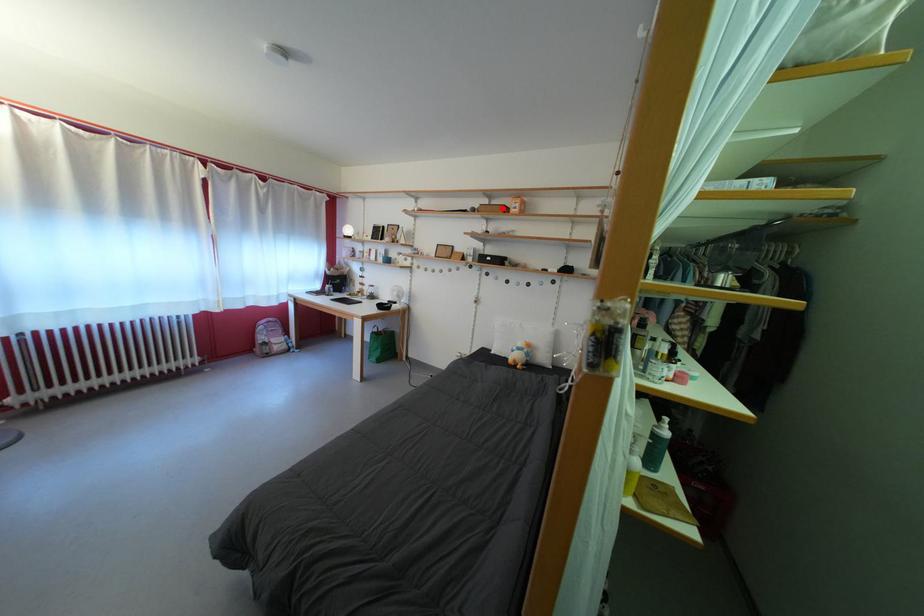
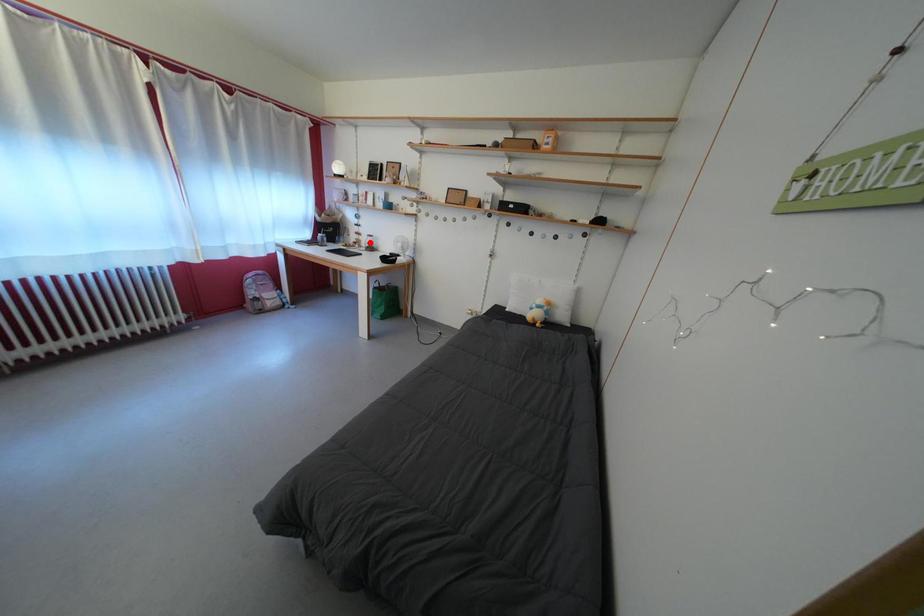
I am providing you with two images of the same scene from different viewpoints. A red point is marked on the first image and another point is marked on the second image. Do the highlighted points in image1 and image2 indicate the same real-world spot?

No